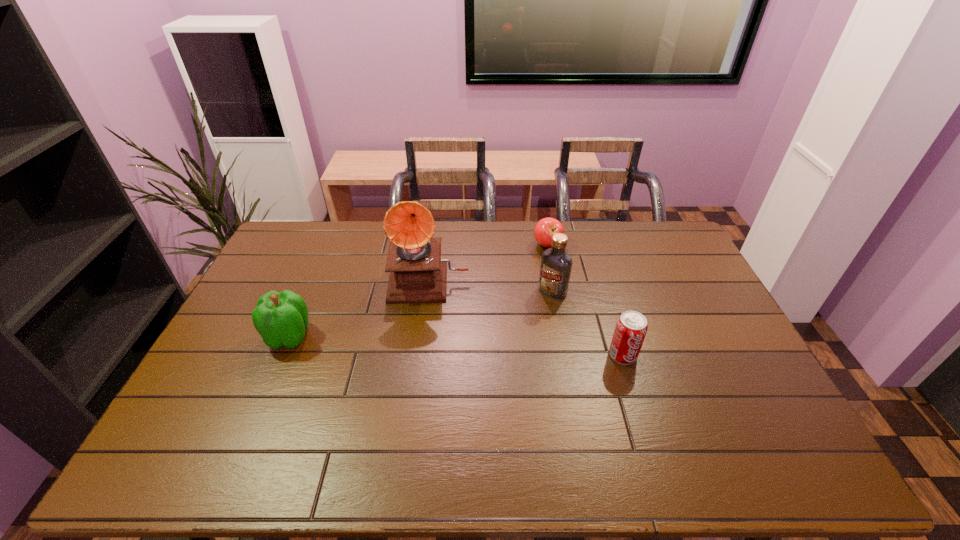
Find the location of `free region located 0.050m on the stem of the shortest object`. free region located 0.050m on the stem of the shortest object is located at coordinates (537, 260).

Locate an element on the screen. free space located 0.230m on the stem of the shortest object is located at coordinates (516, 289).

Where is `vacant space located 0.350m on the stem of the shortest object`? The height and width of the screenshot is (540, 960). vacant space located 0.350m on the stem of the shortest object is located at coordinates (500, 312).

You are a GUI agent. You are given a task and a screenshot of the screen. Output one action in this format:
    pyautogui.click(x=<x>, y=<y>)
    Task: Click on the blank area located on the horn of the tallest object
    
    Given the screenshot: What is the action you would take?
    pyautogui.click(x=423, y=371)

Find the location of `blank space located 0.100m on the horn of the tallest object`. blank space located 0.100m on the horn of the tallest object is located at coordinates (426, 326).

Image resolution: width=960 pixels, height=540 pixels. I want to click on free spot located 0.140m on the horn of the tallest object, so click(x=425, y=336).

Find the location of a particular element. The image size is (960, 540). vacant region located on the front-facing side of the second tallest object is located at coordinates (466, 372).

Locate an element on the screen. The width and height of the screenshot is (960, 540). free region located on the front-facing side of the second tallest object is located at coordinates (530, 312).

This screenshot has width=960, height=540. Identify the location of blank space located on the front-facing side of the second tallest object. [x=501, y=339].

Find the location of `apple situated at the far edge`. apple situated at the far edge is located at coordinates (544, 230).